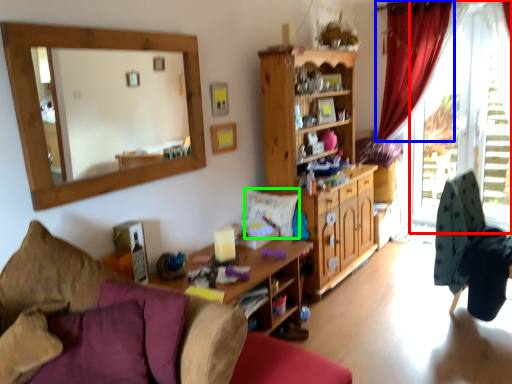
Question: Considering the real-world distances, which object is farthest from window frame (highlighted by a red box)? curtain (highlighted by a blue box) or pillow (highlighted by a green box)?

Choices:
 (A) curtain
 (B) pillow

Answer: (B)